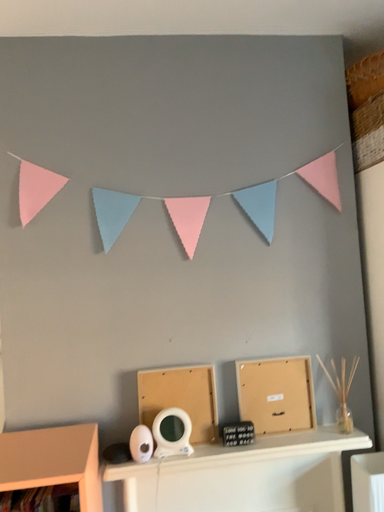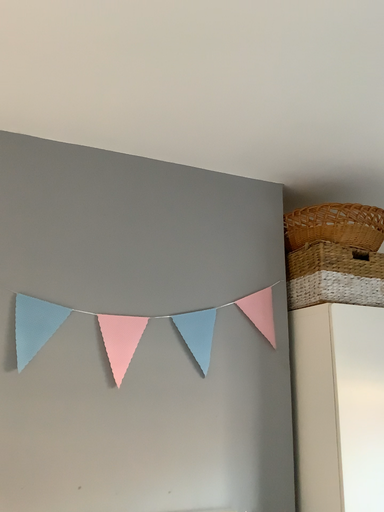
Question: Which way did the camera rotate in the video?

Choices:
 (A) rotated left
 (B) rotated right

Answer: (B)